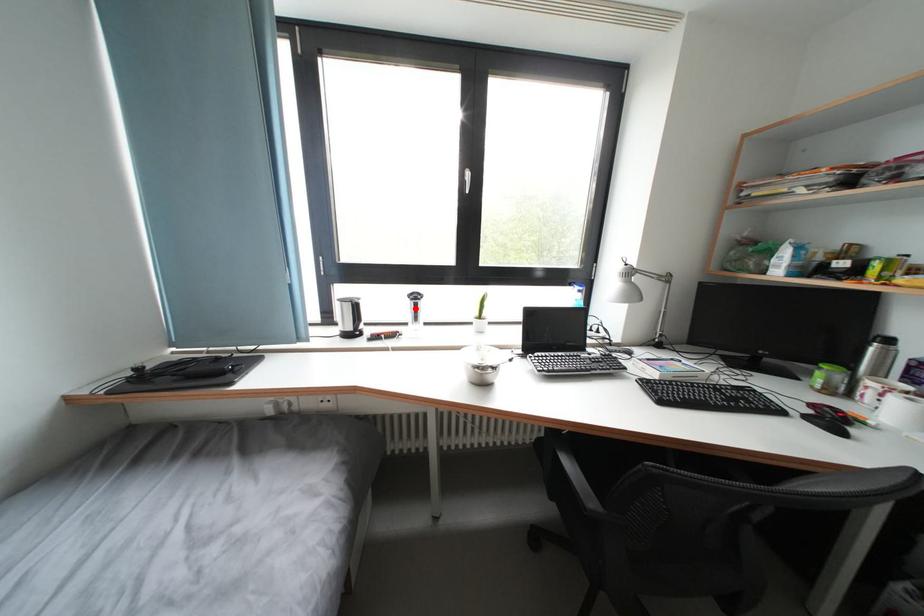
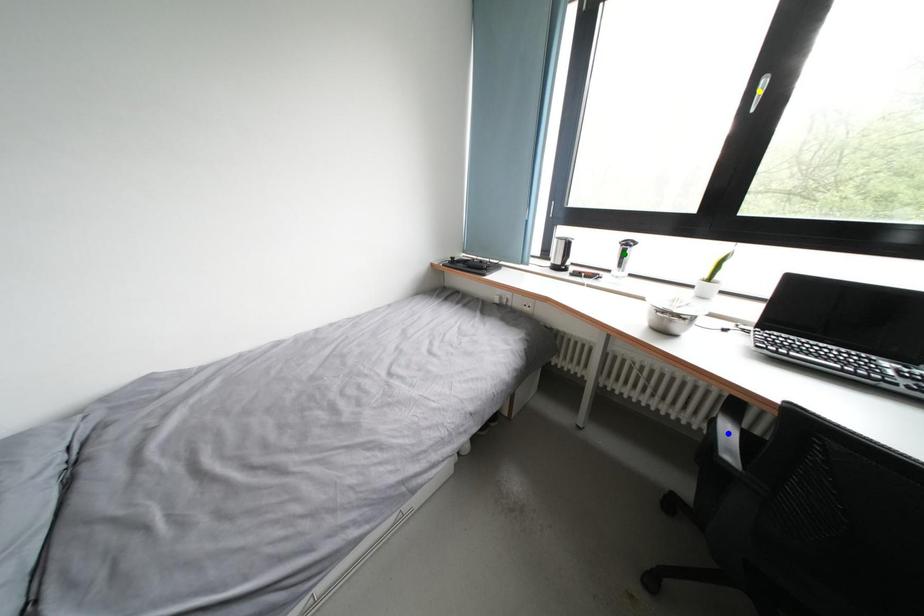
Question: I am providing you with two images of the same scene from different viewpoints. A red point is marked on the first image. You are given multiple points on the second image. Which spot in image 2 lines up with the point in image 1?

Choices:
 (A) blue point
 (B) green point
 (C) yellow point

Answer: (B)